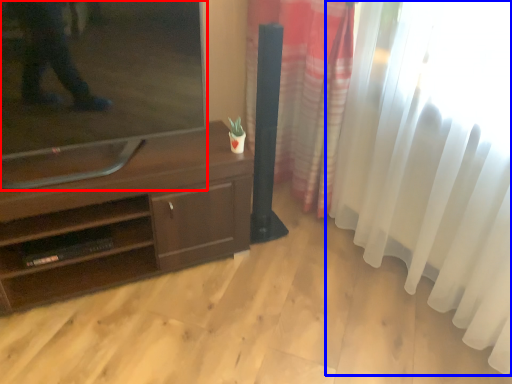
Question: Which object appears closest to the camera in this image, television (highlighted by a red box) or curtain (highlighted by a blue box)?

Choices:
 (A) television
 (B) curtain

Answer: (B)